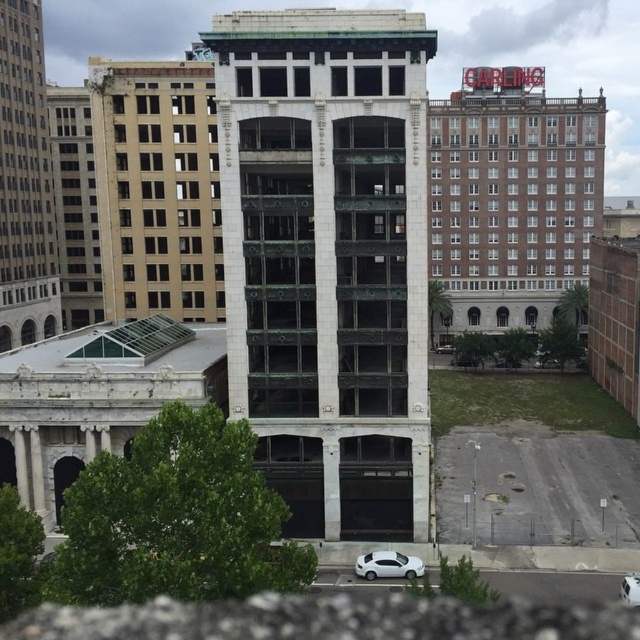
Which is below, beige stone tower at left or white matte car at lower center?

Positioned lower is white matte car at lower center.

I want to click on beige stone tower at left, so click(24, 182).

Locate an element on the screen. The image size is (640, 640). beige stone tower at left is located at coordinates (24, 182).

The image size is (640, 640). I want to click on beige stone tower at left, so click(x=24, y=182).

Is the position of white glossy sedan at lower center more distant than that of white matte car at lower center?

Yes.

Consider the image. Can you confirm if white glossy sedan at lower center is positioned below white matte car at lower center?

No, white glossy sedan at lower center is not below white matte car at lower center.

Does point (360, 566) come farther from viewer compared to point (625, 600)?

Yes, point (360, 566) is behind point (625, 600).

Locate an element on the screen. white glossy sedan at lower center is located at coordinates (388, 564).

Does green marble tower at center have a greater width compared to white glossy sedan at lower center?

Correct, the width of green marble tower at center exceeds that of white glossy sedan at lower center.

Is green marble tower at center taller than white glossy sedan at lower center?

Correct, green marble tower at center is much taller as white glossy sedan at lower center.

Is point (289, 124) positioned before point (410, 577)?

No, (289, 124) is further to viewer.

Identify the location of green marble tower at center. (328, 259).